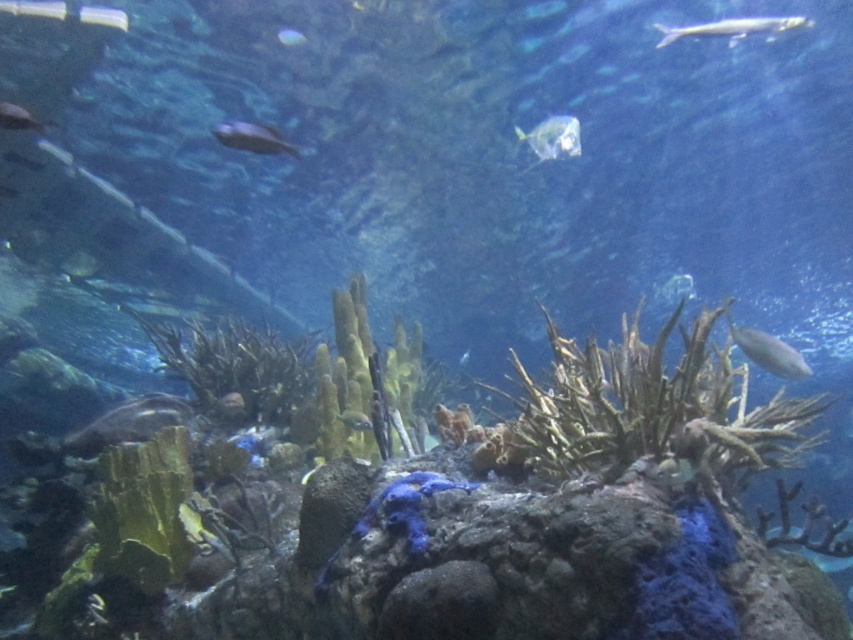
You are an underwater photographer aiming to capture both the shiny blue fish at upper center and the translucent glass fish at center in a single shot. Which fish should you position closer to the left side of your camera frame to include both in the photo?

To include both the shiny blue fish at upper center and the translucent glass fish at center in the photo, you should position the shiny blue fish at upper center closer to the left side of your camera frame since it is already on the left side of the translucent glass fish at center.

You are an underwater photographer aiming to capture both the shiny blue fish at upper center and the translucent glass fish at center in a single shot. Considering their sizes, which fish should you focus on first to ensure both are in frame?

The shiny blue fish at upper center is smaller in height than the translucent glass fish at center. To ensure both are in frame, focus on the translucent glass fish at center first as it is larger and might require more adjustment to fit within the shot.